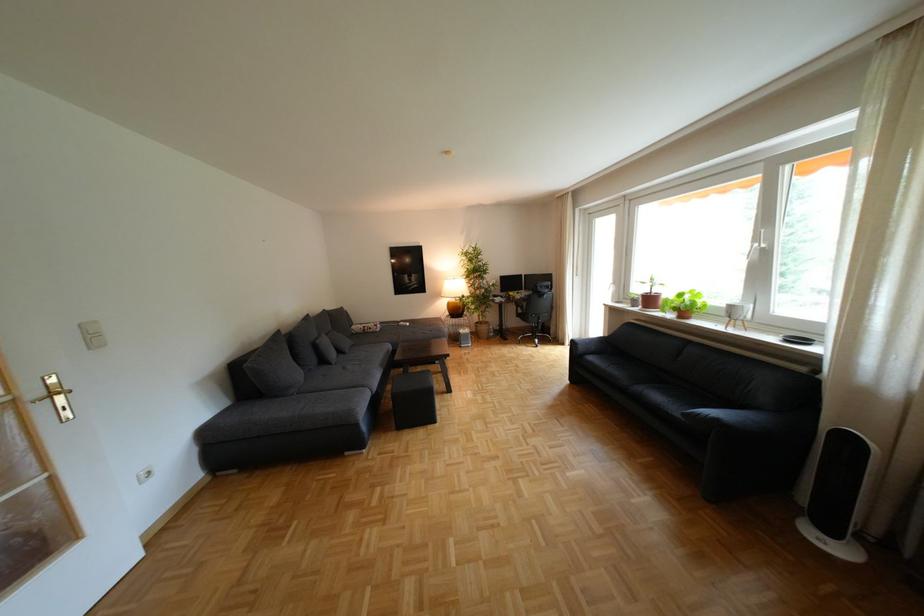
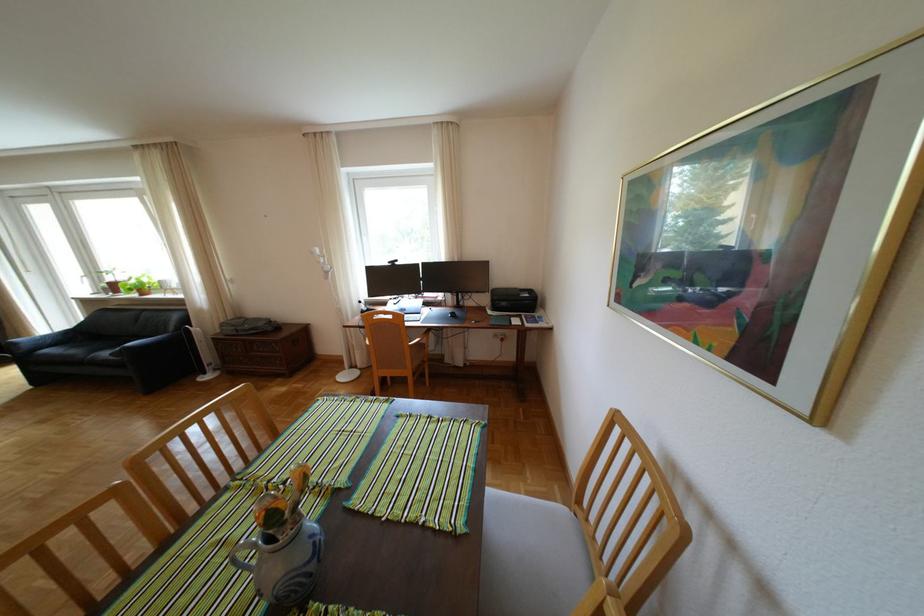
Where in the second image is the point corresponding to the point at 706,302 from the first image?

(154, 283)